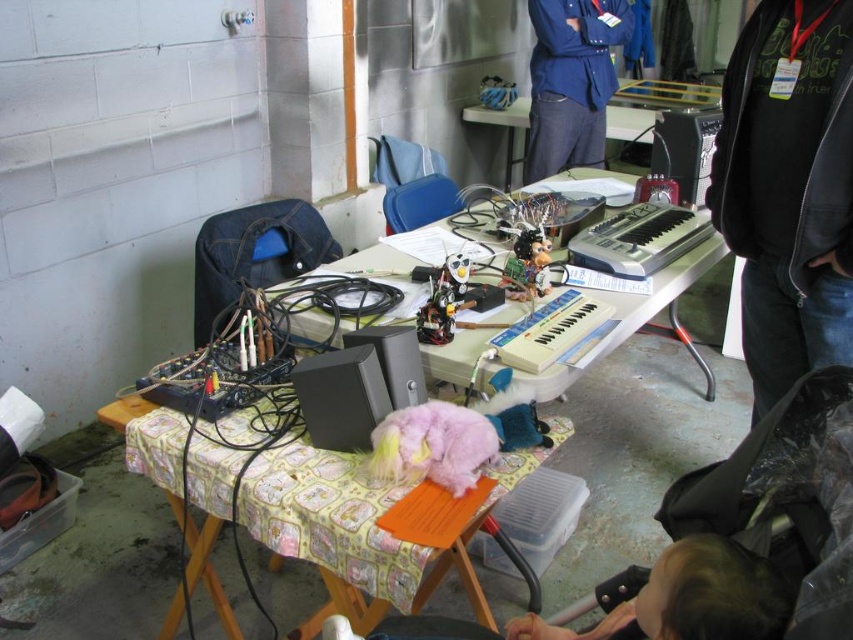
Question: Which object is the farthest from the blue denim shirt at upper center?

Choices:
 (A) white plastic table at center
 (B) fuzzy pink plushie at center

Answer: (B)

Question: Estimate the real-world distances between objects in this image. Which object is farther from the silver metallic keyboard at center?

Choices:
 (A) blue denim shirt at upper center
 (B) white plastic table at center
 (C) fuzzy pink plushie at center

Answer: (A)

Question: Does fuzzy pink plushie at center have a greater width compared to white plastic table at center?

Choices:
 (A) yes
 (B) no

Answer: (A)

Question: In this image, where is light brown hair at lower center located relative to white plastic table at center?

Choices:
 (A) right
 (B) left

Answer: (B)

Question: In this image, where is black fleece jacket at upper right located relative to silver metallic keyboard at center?

Choices:
 (A) left
 (B) right

Answer: (B)

Question: Which is farther from the light brown hair at lower center?

Choices:
 (A) fuzzy pink plushie at center
 (B) black fleece jacket at upper right

Answer: (B)